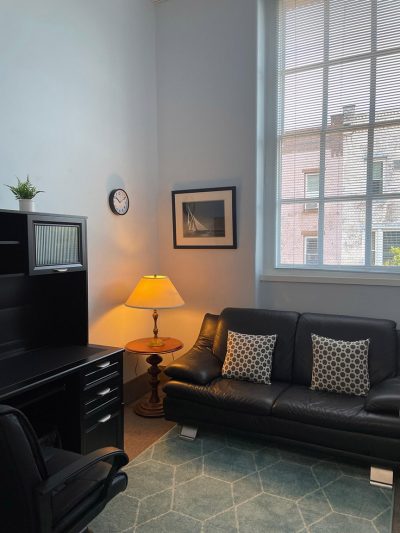
Image resolution: width=400 pixels, height=533 pixels. I want to click on pillows, so click(345, 375), click(253, 365).